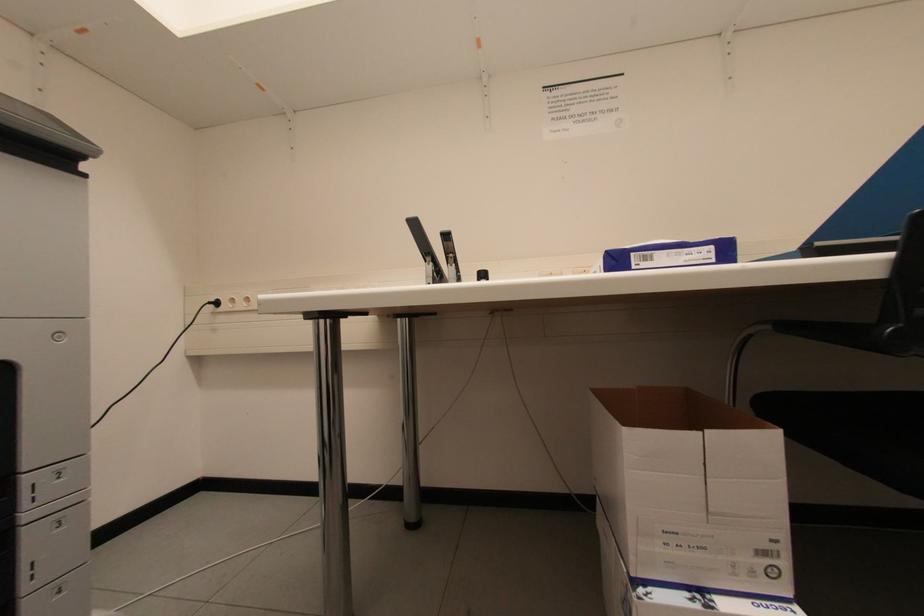
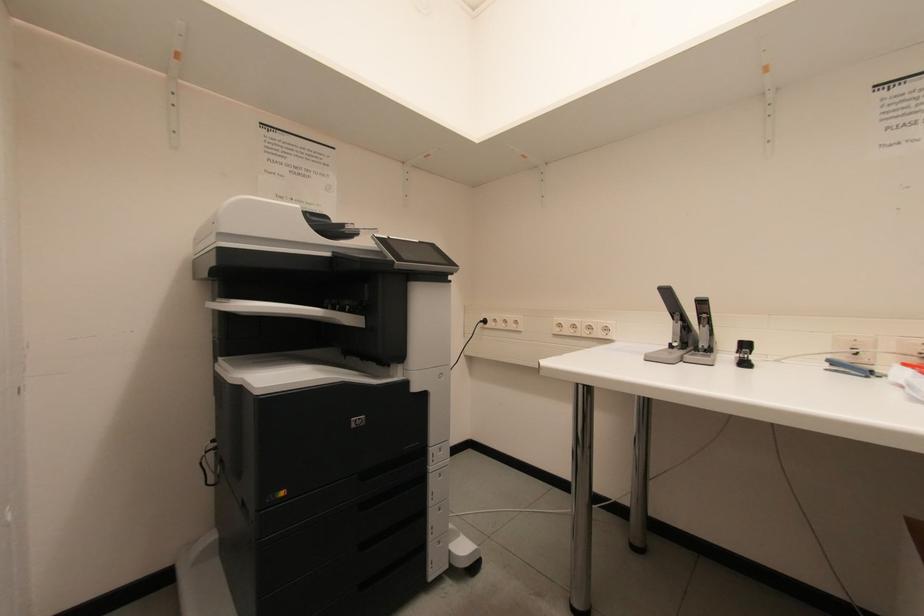
Question: The images are taken continuously from a first-person perspective. In which direction is your viewpoint rotating?

Choices:
 (A) Left
 (B) Right
 (C) Up
 (D) Down

Answer: (A)